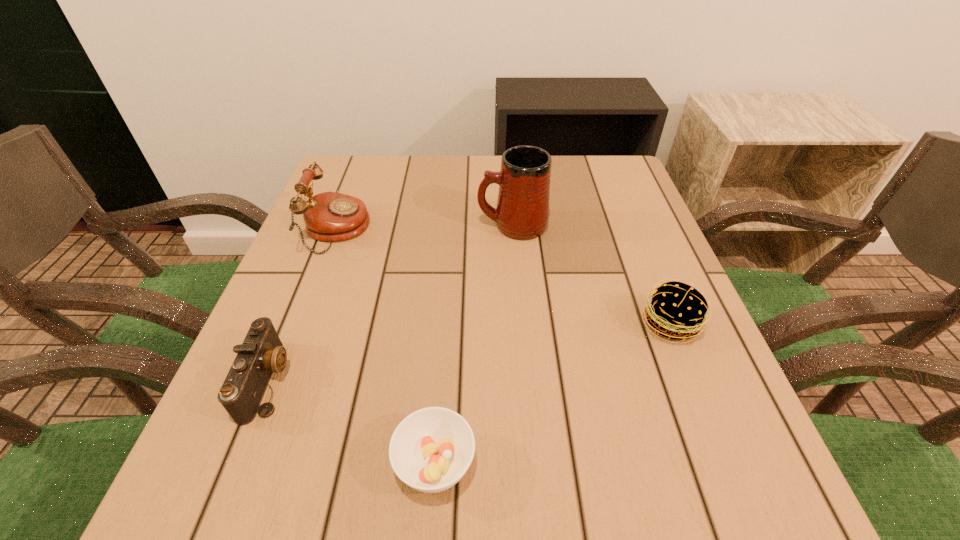
The height and width of the screenshot is (540, 960). In the image, there is a desktop. In order to click on free space at the far edge in this screenshot , I will do `click(457, 170)`.

Where is `vacant region at the near edge of the desktop`? vacant region at the near edge of the desktop is located at coordinates (477, 496).

Find the location of a particular element. This screenshot has height=540, width=960. free region at the left edge of the desktop is located at coordinates (343, 244).

Identify the location of free point at the right edge. (638, 291).

Image resolution: width=960 pixels, height=540 pixels. I want to click on vacant space at the far left corner of the desktop, so [x=381, y=156].

Find the location of `vacant position at the far right corner of the desktop`. vacant position at the far right corner of the desktop is located at coordinates (604, 203).

Locate an element on the screen. The image size is (960, 540). vacant space at the near right corner of the desktop is located at coordinates (760, 494).

At what (x,y) coordinates should I click in order to perform the action: click on vacant space in between the camera and the telephone. Please return your answer as a coordinate pair (x, y). Looking at the image, I should click on (302, 305).

Identify the location of vacant area between the patty and the telephone. 503,277.

Locate an element on the screen. This screenshot has width=960, height=540. free space between the telephone and the camera is located at coordinates (302, 305).